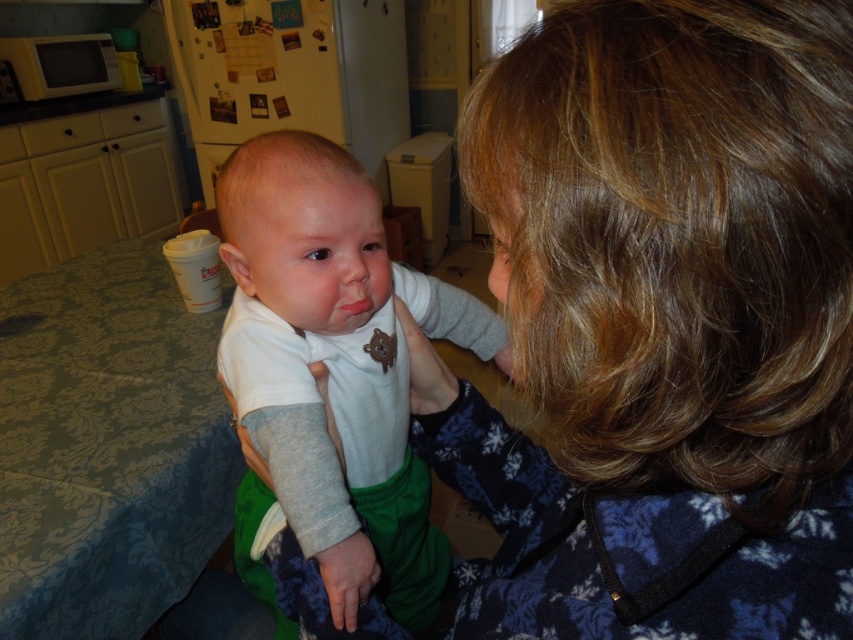
Question: In this image, where is blue fleece jacket at upper right located relative to white soft fabric baby at center?

Choices:
 (A) right
 (B) left

Answer: (A)

Question: Which of the following is the farthest from the observer?

Choices:
 (A) white soft fabric baby at center
 (B) blue fleece jacket at upper right

Answer: (A)

Question: Which of the following is the farthest from the observer?

Choices:
 (A) blue fleece jacket at upper right
 (B) white soft fabric baby at center

Answer: (B)

Question: From the image, what is the correct spatial relationship of blue fleece jacket at upper right in relation to white soft fabric baby at center?

Choices:
 (A) left
 (B) right

Answer: (B)

Question: Is blue fleece jacket at upper right smaller than white soft fabric baby at center?

Choices:
 (A) no
 (B) yes

Answer: (B)